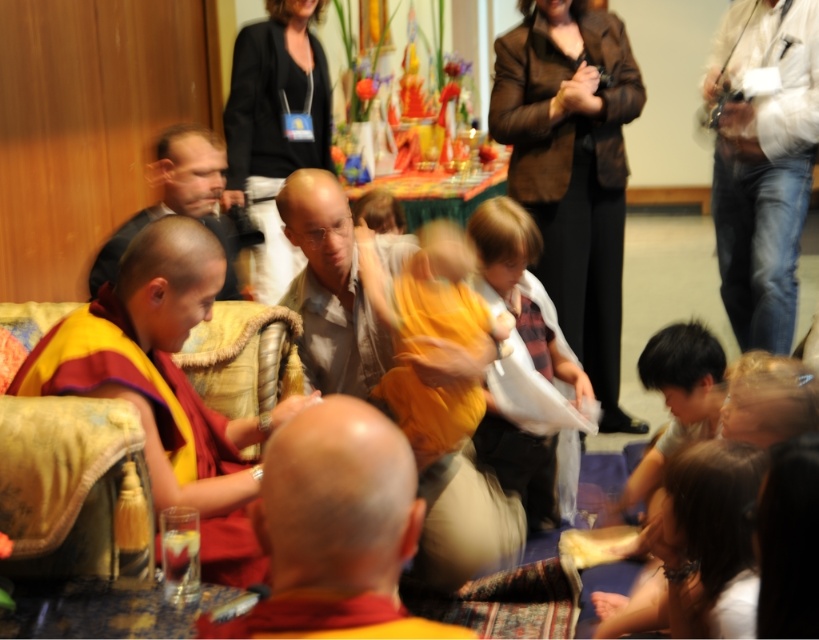
Which is below, red robe monk at left or bald head monk at center?

bald head monk at center is below.

Is red robe monk at left positioned before bald head monk at center?

No, red robe monk at left is further to the viewer.

Between point (238, 499) and point (331, 467), which one is positioned behind?

The point (238, 499) is more distant.

The image size is (819, 640). I want to click on red robe monk at left, so click(x=165, y=385).

Which of these two, plaid fabric robe at center or red robe monk at left, stands shorter?

With less height is red robe monk at left.

Is plaid fabric robe at center taller than red robe monk at left?

Yes.

Which is behind, point (612, 374) or point (39, 356)?

Point (612, 374)

Identify the location of plaid fabric robe at center. The width and height of the screenshot is (819, 640). (572, 168).

Is plaid fabric robe at center positioned behind matte gray shirt at center?

Yes, it is.

Between point (568, 236) and point (442, 588), which one is positioned behind?

Point (568, 236)

Locate an element on the screen. plaid fabric robe at center is located at coordinates (572, 168).